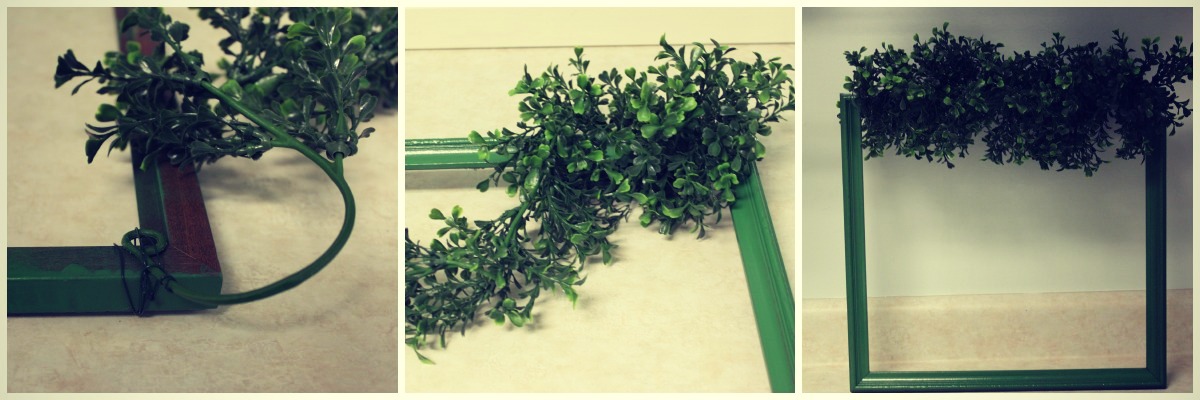
What are the coordinates of `last green plant` in the screenshot? It's located at (1110, 92).